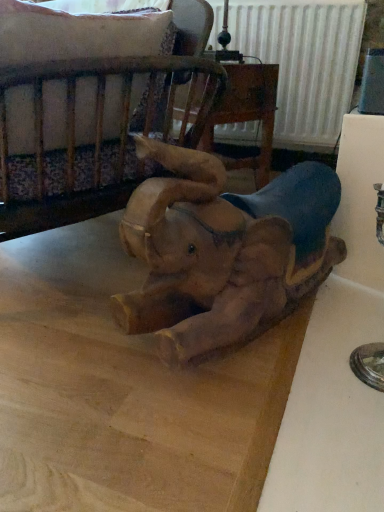
Question: From a real-world perspective, relative to wooden elephant at center, is wooden crib at upper left vertically above or below?

Choices:
 (A) above
 (B) below

Answer: (A)

Question: From the image's perspective, is wooden crib at upper left located above or below wooden elephant at center?

Choices:
 (A) above
 (B) below

Answer: (A)

Question: Visually, is wooden crib at upper left positioned to the left or to the right of wooden elephant at center?

Choices:
 (A) left
 (B) right

Answer: (A)

Question: Is wooden elephant at center inside or outside of wooden crib at upper left?

Choices:
 (A) inside
 (B) outside

Answer: (B)

Question: From the image's perspective, is wooden elephant at center positioned above or below wooden crib at upper left?

Choices:
 (A) above
 (B) below

Answer: (B)

Question: Does point (291, 197) appear closer or farther from the camera than point (69, 104)?

Choices:
 (A) closer
 (B) farther

Answer: (B)

Question: Looking at the image, does wooden elephant at center seem bigger or smaller compared to wooden crib at upper left?

Choices:
 (A) small
 (B) big

Answer: (B)